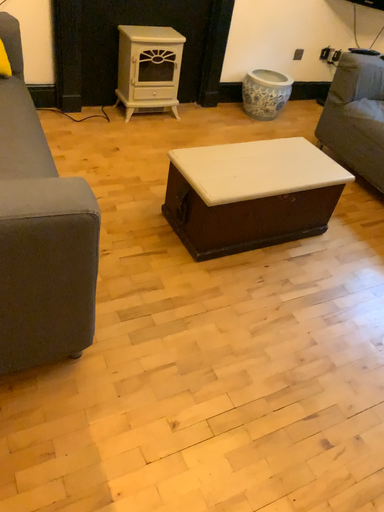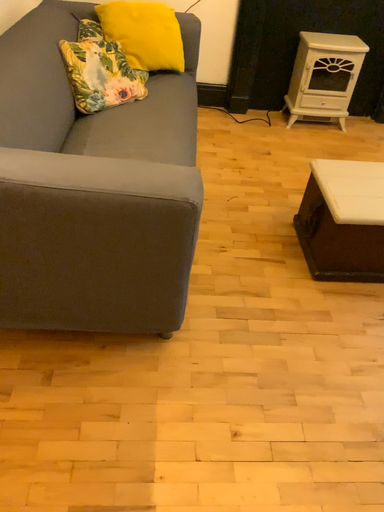
Question: How did the camera likely rotate when shooting the video?

Choices:
 (A) rotated left
 (B) rotated right

Answer: (A)